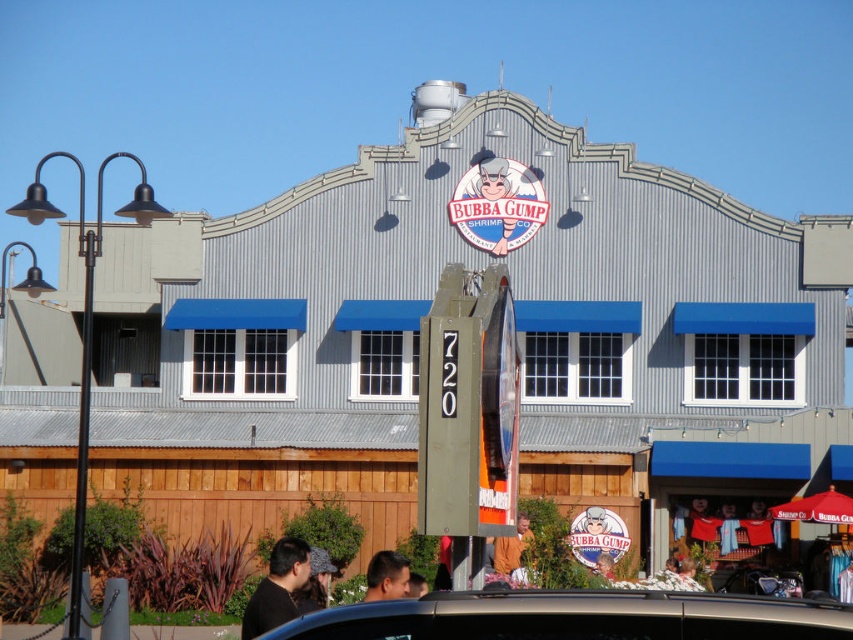
Can you confirm if orange fabric at center is positioned to the right of matte plastic sign at center?

In fact, orange fabric at center is to the left of matte plastic sign at center.

Looking at this image, can you confirm if orange fabric at center is thinner than matte plastic sign at center?

No.

Is point (511, 541) positioned after point (595, 572)?

No.

You are a GUI agent. You are given a task and a screenshot of the screen. Output one action in this format:
    pyautogui.click(x=<x>, y=<y>)
    Task: Click on the orange fabric at center
    This screenshot has height=640, width=853.
    Given the screenshot: What is the action you would take?
    pyautogui.click(x=511, y=547)

Between point (300, 556) and point (296, 600), which one is positioned in front?

Point (300, 556)

Measure the distance between black matte shirt at lower left and dark brown leather hat at center.

The distance of black matte shirt at lower left from dark brown leather hat at center is 3.73 meters.

Between point (273, 557) and point (323, 564), which one is positioned behind?

The point (323, 564) is more distant.

I want to click on black matte shirt at lower left, so click(277, 588).

Between point (300, 605) and point (610, 566), which one is positioned in front?

Point (300, 605) is more forward.

Is point (309, 604) closer to camera compared to point (602, 563)?

That is True.

I want to click on dark brown leather hat at center, so click(x=314, y=582).